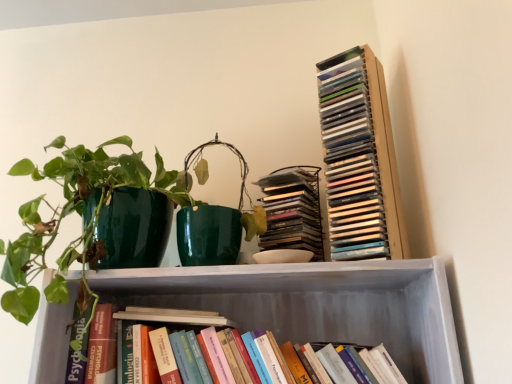
What do you see at coordinates (359, 158) in the screenshot? I see `clear plastic stack of cds at upper right, positioned as the 3th book in bottom-to-top order` at bounding box center [359, 158].

Find the location of `green glossy pot at left`. green glossy pot at left is located at coordinates (72, 212).

Find the location of a particular element. This screenshot has height=384, width=512. hardcover books at lower center, the 3th book when ordered from top to bottom is located at coordinates (176, 349).

Find the location of a particular element. clear plastic stack of cds at upper right, positioned as the 3th book in bottom-to-top order is located at coordinates (359, 158).

What's the angular difference between matte plastic stack of cds at upper right, marked as the 2th book in a bottom-to-top arrangement, and green glossy pot at left's facing directions?

The angular difference between matte plastic stack of cds at upper right, marked as the 2th book in a bottom-to-top arrangement, and green glossy pot at left is 29.9 degrees.

From the image's perspective, is matte plastic stack of cds at upper right, marked as the 2th book in a bottom-to-top arrangement, located above or below green glossy pot at left?

matte plastic stack of cds at upper right, marked as the 2th book in a bottom-to-top arrangement, is situated higher than green glossy pot at left in the image.

Considering the points (312, 182) and (59, 266), which point is behind, point (312, 182) or point (59, 266)?

Positioned behind is point (59, 266).

From the picture: Is matte plastic stack of cds at upper right, the second book positioned from the top, at the left side of green glossy pot at left?

No.

Where is `the 2nd book counting from the right of the green glossy pot at left`? The image size is (512, 384). the 2nd book counting from the right of the green glossy pot at left is located at coordinates (292, 210).

Is green glossy pot at left smaller than matte plastic stack of cds at upper right, marked as the 2th book in a bottom-to-top arrangement?

Actually, green glossy pot at left might be larger than matte plastic stack of cds at upper right, marked as the 2th book in a bottom-to-top arrangement.

Is green glossy pot at left touching matte plastic stack of cds at upper right, marked as the 2th book in a bottom-to-top arrangement?

No, green glossy pot at left is not beside matte plastic stack of cds at upper right, marked as the 2th book in a bottom-to-top arrangement.

Is green glossy pot at left aimed at matte plastic stack of cds at upper right, the second book positioned from the top?

No, green glossy pot at left is not turned towards matte plastic stack of cds at upper right, the second book positioned from the top.

Is hardcover books at lower center, the 1th book positioned from the bottom, to the left of green glossy pot at left from the viewer's perspective?

Incorrect, hardcover books at lower center, the 1th book positioned from the bottom, is not on the left side of green glossy pot at left.

Is point (89, 359) positioned after point (143, 166)?

No, it is in front of (143, 166).

Considering the sizes of objects hardcover books at lower center, the 3th book when ordered from top to bottom, and green glossy pot at left in the image provided, who is thinner, hardcover books at lower center, the 3th book when ordered from top to bottom, or green glossy pot at left?

With smaller width is hardcover books at lower center, the 3th book when ordered from top to bottom.

Considering the sizes of objects clear plastic stack of cds at upper right, acting as the first book starting from the top, and hardcover books at lower center, the 1th book positioned from the bottom, in the image provided, who is thinner, clear plastic stack of cds at upper right, acting as the first book starting from the top, or hardcover books at lower center, the 1th book positioned from the bottom,?

clear plastic stack of cds at upper right, acting as the first book starting from the top, is thinner.

In the scene shown: From the image's perspective, is clear plastic stack of cds at upper right, acting as the first book starting from the top, located above hardcover books at lower center, the 3th book when ordered from top to bottom?

Yes, from the image's perspective, clear plastic stack of cds at upper right, acting as the first book starting from the top, is on top of hardcover books at lower center, the 3th book when ordered from top to bottom.

Is hardcover books at lower center, the 3th book when ordered from top to bottom, a part of clear plastic stack of cds at upper right, positioned as the 3th book in bottom-to-top order?

No, hardcover books at lower center, the 3th book when ordered from top to bottom, is not surrounded by clear plastic stack of cds at upper right, positioned as the 3th book in bottom-to-top order.

Considering their positions, is clear plastic stack of cds at upper right, positioned as the 3th book in bottom-to-top order, located in front of or behind hardcover books at lower center, the 1th book positioned from the bottom?

clear plastic stack of cds at upper right, positioned as the 3th book in bottom-to-top order, is positioned farther from the viewer than hardcover books at lower center, the 1th book positioned from the bottom.

Which is more to the left, hardcover books at lower center, the 1th book positioned from the bottom, or matte plastic stack of cds at upper right, marked as the 2th book in a bottom-to-top arrangement?

From the viewer's perspective, hardcover books at lower center, the 1th book positioned from the bottom, appears more on the left side.

Considering their positions, is hardcover books at lower center, the 3th book when ordered from top to bottom, located in front of or behind matte plastic stack of cds at upper right, the second book positioned from the top?

Clearly, hardcover books at lower center, the 3th book when ordered from top to bottom, is in front of matte plastic stack of cds at upper right, the second book positioned from the top.

From the picture: Which is less distant, (268, 332) or (286, 233)?

Point (268, 332).

From the image's perspective, between hardcover books at lower center, the 3th book when ordered from top to bottom, and matte plastic stack of cds at upper right, marked as the 2th book in a bottom-to-top arrangement, who is located below?

hardcover books at lower center, the 3th book when ordered from top to bottom, is shown below in the image.

Do you think hardcover books at lower center, the 1th book positioned from the bottom, is within clear plastic stack of cds at upper right, acting as the first book starting from the top, or outside of it?

hardcover books at lower center, the 1th book positioned from the bottom, is outside clear plastic stack of cds at upper right, acting as the first book starting from the top.

Is hardcover books at lower center, the 3th book when ordered from top to bottom, oriented towards clear plastic stack of cds at upper right, positioned as the 3th book in bottom-to-top order?

No.

Between hardcover books at lower center, the 3th book when ordered from top to bottom, and clear plastic stack of cds at upper right, acting as the first book starting from the top, which one has less height?

Standing shorter between the two is hardcover books at lower center, the 3th book when ordered from top to bottom.

From a real-world perspective, is clear plastic stack of cds at upper right, positioned as the 3th book in bottom-to-top order, above or below matte plastic stack of cds at upper right, the second book positioned from the top?

clear plastic stack of cds at upper right, positioned as the 3th book in bottom-to-top order, is above matte plastic stack of cds at upper right, the second book positioned from the top.

Choose the correct answer: Is clear plastic stack of cds at upper right, acting as the first book starting from the top, inside matte plastic stack of cds at upper right, the second book positioned from the top, or outside it?

clear plastic stack of cds at upper right, acting as the first book starting from the top, is spatially situated outside matte plastic stack of cds at upper right, the second book positioned from the top.

Are clear plastic stack of cds at upper right, positioned as the 3th book in bottom-to-top order, and matte plastic stack of cds at upper right, marked as the 2th book in a bottom-to-top arrangement, located far from each other?

No, there isn't a large distance between clear plastic stack of cds at upper right, positioned as the 3th book in bottom-to-top order, and matte plastic stack of cds at upper right, marked as the 2th book in a bottom-to-top arrangement.

Between clear plastic stack of cds at upper right, acting as the first book starting from the top, and matte plastic stack of cds at upper right, marked as the 2th book in a bottom-to-top arrangement, which one has larger width?

matte plastic stack of cds at upper right, marked as the 2th book in a bottom-to-top arrangement.

Identify the location of houseplant in front of the matte plastic stack of cds at upper right, the second book positioned from the top. This screenshot has width=512, height=384. (72, 212).

From a real-world perspective, which book is the 1st one above the green glossy pot at left? Please provide its 2D coordinates.

[(292, 210)]

Looking at the image, which one is located further to clear plastic stack of cds at upper right, acting as the first book starting from the top, hardcover books at lower center, the 3th book when ordered from top to bottom, or matte plastic stack of cds at upper right, the second book positioned from the top?

Based on the image, hardcover books at lower center, the 3th book when ordered from top to bottom, appears to be further to clear plastic stack of cds at upper right, acting as the first book starting from the top.

Which object lies further to the anchor point matte plastic stack of cds at upper right, the second book positioned from the top, hardcover books at lower center, the 3th book when ordered from top to bottom, or clear plastic stack of cds at upper right, acting as the first book starting from the top?

Based on the image, hardcover books at lower center, the 3th book when ordered from top to bottom, appears to be further to matte plastic stack of cds at upper right, the second book positioned from the top.

Based on the photo, from the image, which object appears to be farther from green glossy pot at left, matte plastic stack of cds at upper right, marked as the 2th book in a bottom-to-top arrangement, or hardcover books at lower center, the 1th book positioned from the bottom?

matte plastic stack of cds at upper right, marked as the 2th book in a bottom-to-top arrangement, lies further to green glossy pot at left than the other object.

Based on their spatial positions, is hardcover books at lower center, the 3th book when ordered from top to bottom, or clear plastic stack of cds at upper right, acting as the first book starting from the top, closer to green glossy pot at left?

Among the two, hardcover books at lower center, the 3th book when ordered from top to bottom, is located nearer to green glossy pot at left.

Considering their positions, is hardcover books at lower center, the 1th book positioned from the bottom, positioned further to clear plastic stack of cds at upper right, positioned as the 3th book in bottom-to-top order, than green glossy pot at left?

green glossy pot at left lies further to clear plastic stack of cds at upper right, positioned as the 3th book in bottom-to-top order, than the other object.

Considering their positions, is matte plastic stack of cds at upper right, the second book positioned from the top, positioned further to clear plastic stack of cds at upper right, positioned as the 3th book in bottom-to-top order, than hardcover books at lower center, the 1th book positioned from the bottom?

hardcover books at lower center, the 1th book positioned from the bottom, is positioned further to the anchor clear plastic stack of cds at upper right, positioned as the 3th book in bottom-to-top order.

From the image, which object appears to be farther from hardcover books at lower center, the 3th book when ordered from top to bottom, matte plastic stack of cds at upper right, marked as the 2th book in a bottom-to-top arrangement, or clear plastic stack of cds at upper right, positioned as the 3th book in bottom-to-top order?

clear plastic stack of cds at upper right, positioned as the 3th book in bottom-to-top order, is further to hardcover books at lower center, the 3th book when ordered from top to bottom.

Which object lies nearer to the anchor point matte plastic stack of cds at upper right, the second book positioned from the top, green glossy pot at left or hardcover books at lower center, the 1th book positioned from the bottom?

hardcover books at lower center, the 1th book positioned from the bottom.

Where is `book between clear plastic stack of cds at upper right, positioned as the 3th book in bottom-to-top order, and hardcover books at lower center, the 1th book positioned from the bottom, vertically`? The width and height of the screenshot is (512, 384). book between clear plastic stack of cds at upper right, positioned as the 3th book in bottom-to-top order, and hardcover books at lower center, the 1th book positioned from the bottom, vertically is located at coordinates (292, 210).

Locate an element on the screen. Image resolution: width=512 pixels, height=384 pixels. book between green glossy pot at left and matte plastic stack of cds at upper right, the second book positioned from the top is located at coordinates (176, 349).